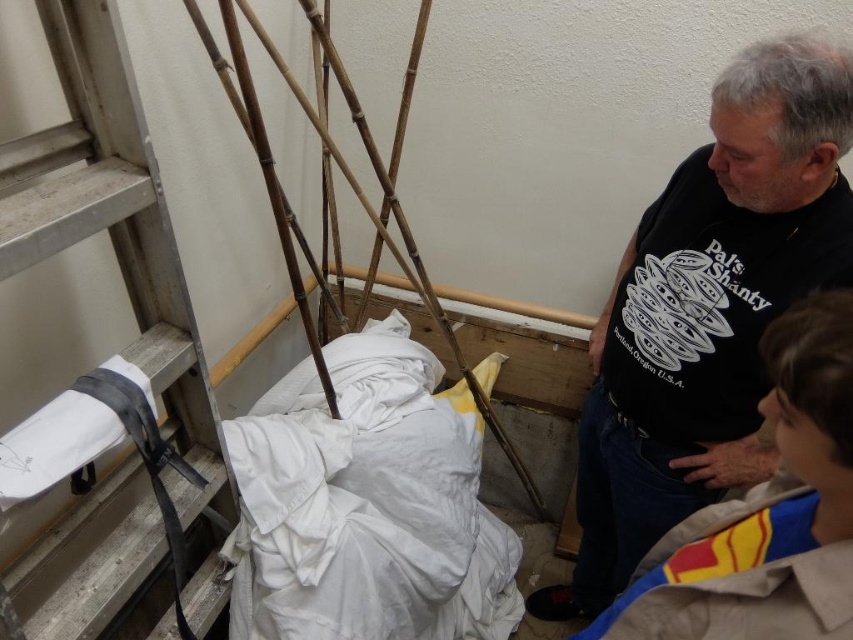
You are a delivery person who needs to place a small package between the white cotton cloth at center and the bamboo at left. Can you fit the package in the space between them if the package is 28 centimeters long?

The distance between the white cotton cloth at center and the bamboo at left is 27.96 centimeters, which is slightly less than the package length of 28 centimeters. Therefore, the package cannot fit in the space between them.